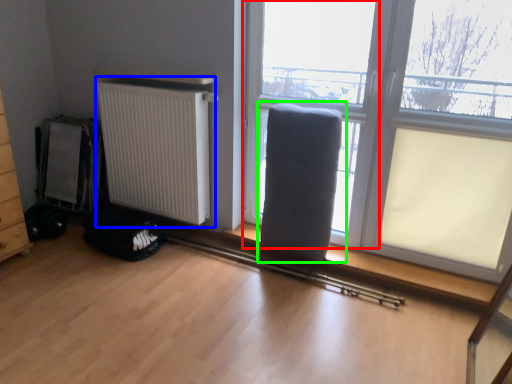
Question: Considering the real-world distances, which object is farthest from window frame (highlighted by a red box)? radiator (highlighted by a blue box) or armchair (highlighted by a green box)?

Choices:
 (A) radiator
 (B) armchair

Answer: (A)